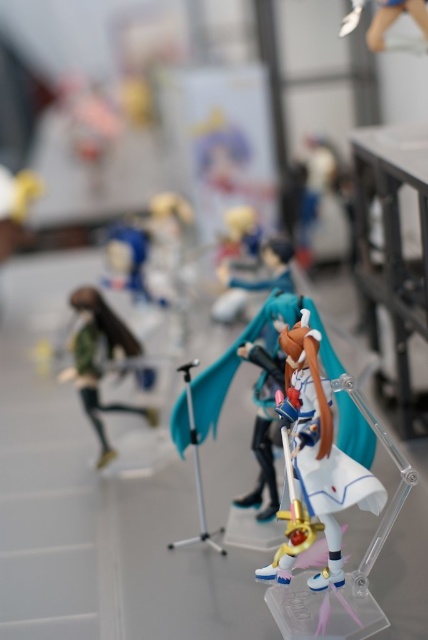
Who is positioned more to the left, satin white figurine at center or matte green figure at left?

From the viewer's perspective, matte green figure at left appears more on the left side.

Can you confirm if satin white figurine at center is thinner than matte green figure at left?

Yes, satin white figurine at center is thinner than matte green figure at left.

Between point (306, 486) and point (133, 406), which one is positioned in front?

Point (306, 486) is more forward.

Identify the location of satin white figurine at center. (321, 445).